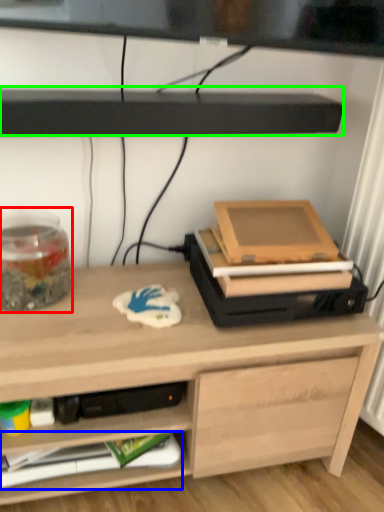
Question: Which is farther away from glass jar (highlighted by a red box)? paperback book (highlighted by a blue box) or shelf (highlighted by a green box)?

Choices:
 (A) paperback book
 (B) shelf

Answer: (A)